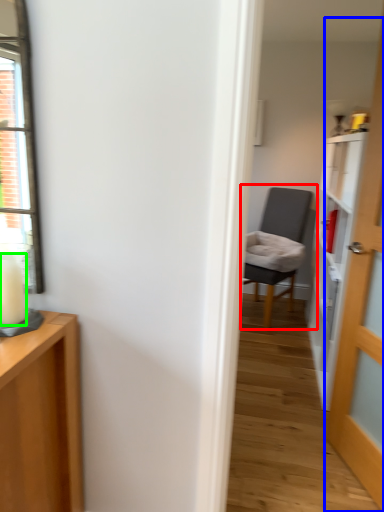
Question: Based on their relative distances, which object is farther from chair (highlighted by a red box)? Choose from door (highlighted by a blue box) and candle (highlighted by a green box).

Choices:
 (A) door
 (B) candle

Answer: (B)